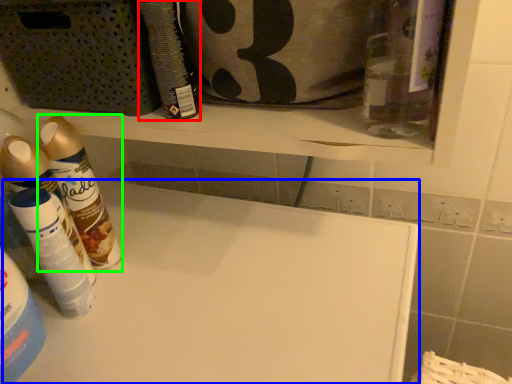
Question: Based on their relative distances, which object is nearer to cleaning product (highlighted by a red box)? Choose from counter (highlighted by a blue box) and cleaning product (highlighted by a green box).

Choices:
 (A) counter
 (B) cleaning product

Answer: (B)